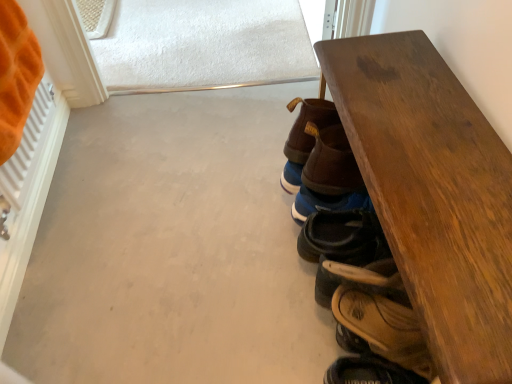
Question: In the image, is brown leather sandal at lower right, acting as the 1th footwear starting from the bottom, positioned in front of or behind brown leather shoe at center, marked as the first footwear in a top-to-bottom arrangement?

Choices:
 (A) front
 (B) behind

Answer: (A)

Question: Considering the positions of point (409, 319) and point (309, 112), is point (409, 319) closer or farther from the camera than point (309, 112)?

Choices:
 (A) closer
 (B) farther

Answer: (A)

Question: Which is farther from the brown leather sandal at lower right, which ranks as the 4th footwear in top-to-bottom order?

Choices:
 (A) orange plush blanket at left
 (B) blue suede shoes at lower right, which ranks as the 2th footwear in top-to-bottom order
 (C) brown leather shoe at center, marked as the first footwear in a top-to-bottom arrangement
 (D) wooden table at right
 (E) leather sandal at lower right, the third footwear positioned from the top

Answer: (A)

Question: Which of these objects is positioned closest to the leather sandal at lower right, the third footwear positioned from the top?

Choices:
 (A) brown leather shoe at center, marked as the first footwear in a top-to-bottom arrangement
 (B) brown leather sandal at lower right, which ranks as the 4th footwear in top-to-bottom order
 (C) orange plush blanket at left
 (D) blue suede shoes at lower right, the 3th footwear from the bottom
 (E) wooden table at right

Answer: (B)